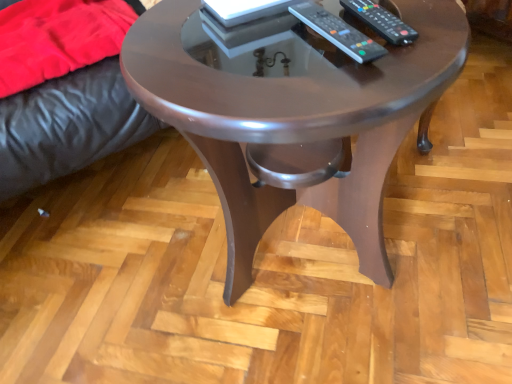
Question: Is velvet red blanket at left positioned far away from black plastic remote at upper right, marked as the 1th remote in a right-to-left arrangement?

Choices:
 (A) no
 (B) yes

Answer: (A)

Question: Does velvet red blanket at left lie in front of black plastic remote at upper right, positioned as the second remote in left-to-right order?

Choices:
 (A) yes
 (B) no

Answer: (B)

Question: Does velvet red blanket at left appear on the left side of black plastic remote at upper right, marked as the 1th remote in a right-to-left arrangement?

Choices:
 (A) no
 (B) yes

Answer: (B)

Question: Is black plastic remote at upper right, marked as the 1th remote in a right-to-left arrangement, completely or partially inside velvet red blanket at left?

Choices:
 (A) no
 (B) yes

Answer: (A)

Question: Does velvet red blanket at left appear on the right side of black plastic remote at upper right, positioned as the second remote in left-to-right order?

Choices:
 (A) yes
 (B) no

Answer: (B)

Question: Is velvet red blanket at left thinner than black plastic remote at upper right, marked as the 1th remote in a right-to-left arrangement?

Choices:
 (A) no
 (B) yes

Answer: (A)

Question: From a real-world perspective, is velvet red blanket at left on shiny brown wood coffee table at center?

Choices:
 (A) yes
 (B) no

Answer: (A)

Question: Is velvet red blanket at left surrounding shiny brown wood coffee table at center?

Choices:
 (A) yes
 (B) no

Answer: (B)

Question: Is velvet red blanket at left wider than shiny brown wood coffee table at center?

Choices:
 (A) yes
 (B) no

Answer: (B)

Question: Is velvet red blanket at left in front of shiny brown wood coffee table at center?

Choices:
 (A) no
 (B) yes

Answer: (A)

Question: From a real-world perspective, is velvet red blanket at left located beneath shiny brown wood coffee table at center?

Choices:
 (A) no
 (B) yes

Answer: (A)

Question: Is velvet red blanket at left positioned with its back to shiny brown wood coffee table at center?

Choices:
 (A) yes
 (B) no

Answer: (B)

Question: Considering the relative positions of shiny brown wood coffee table at center and black plastic remote at center, which is the 2th remote from right to left, in the image provided, is shiny brown wood coffee table at center to the left of black plastic remote at center, which is the 2th remote from right to left, from the viewer's perspective?

Choices:
 (A) no
 (B) yes

Answer: (B)